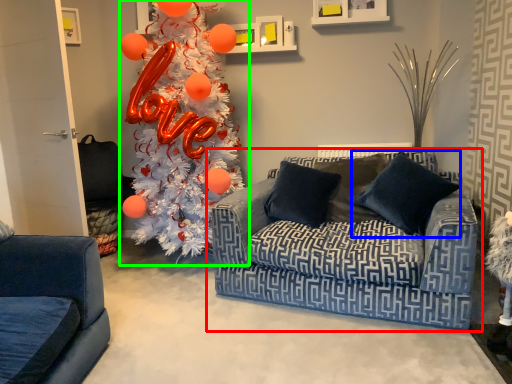
Question: Which object is the closest to the studio couch (highlighted by a red box)? Choose among these: pillow (highlighted by a blue box) or christmas tree (highlighted by a green box).

Choices:
 (A) pillow
 (B) christmas tree

Answer: (A)